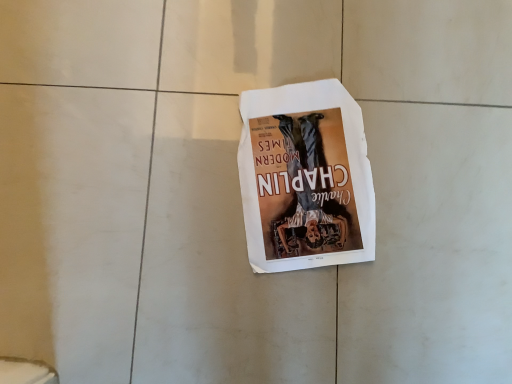
Identify the location of blank space situated above matte paper poster at center (from a real-world perspective). The image size is (512, 384). pyautogui.click(x=311, y=210).